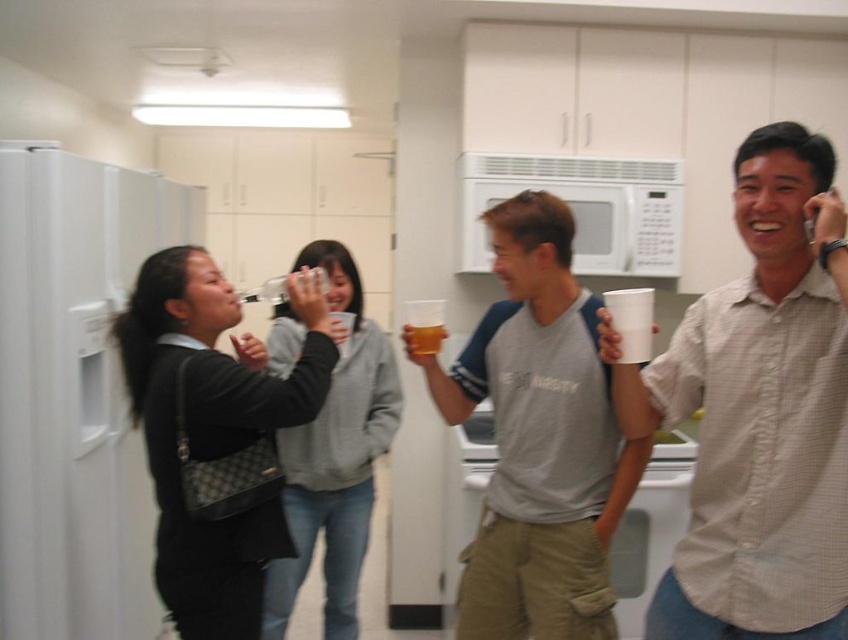
Consider the image. Who is taller, white matte refrigerator at left or matte black purse at left?

white matte refrigerator at left

Who is higher up, white matte refrigerator at left or matte black purse at left?

Positioned higher is white matte refrigerator at left.

Locate an element on the screen. This screenshot has height=640, width=848. white matte refrigerator at left is located at coordinates (74, 392).

The height and width of the screenshot is (640, 848). Find the location of `matte black purse at left`. matte black purse at left is located at coordinates (213, 428).

Where is `matte black purse at left`? This screenshot has width=848, height=640. matte black purse at left is located at coordinates (213, 428).

Does matte gray hoodie at center have a greater width compared to white matte microwave at upper center?

→ No.

Can you confirm if matte gray hoodie at center is taller than white matte microwave at upper center?

Yes, matte gray hoodie at center is taller than white matte microwave at upper center.

Identify the location of matte gray hoodie at center. (335, 458).